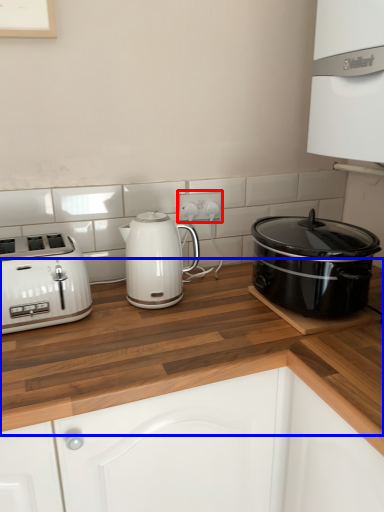
Question: Which object appears closest to the camera in this image, electric outlet (highlighted by a red box) or counter top (highlighted by a blue box)?

Choices:
 (A) electric outlet
 (B) counter top

Answer: (B)